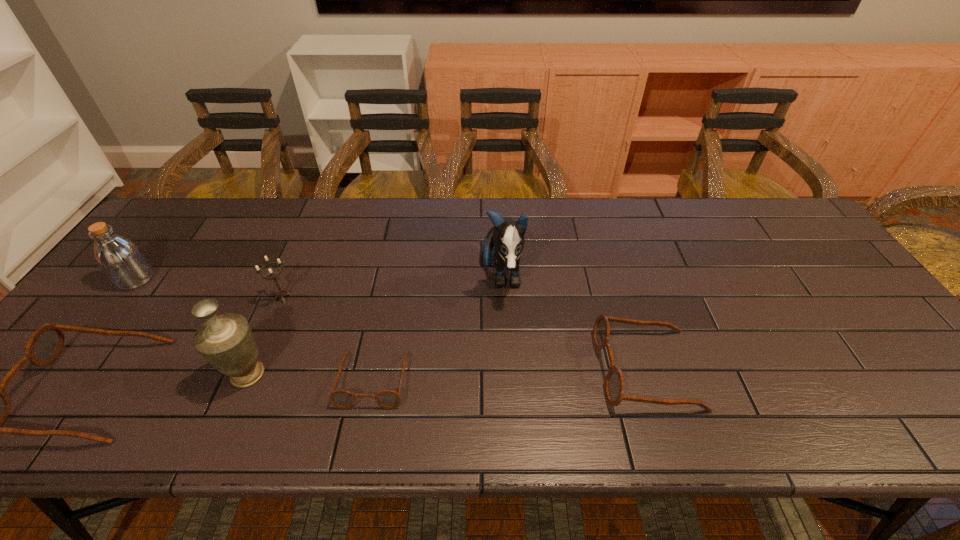
Where is `free space at the far left corner of the desktop`? This screenshot has width=960, height=540. free space at the far left corner of the desktop is located at coordinates (194, 217).

In the image, there is a desktop. What are the coordinates of `free region at the near right corner` in the screenshot? It's located at (860, 373).

I want to click on blank region between the second object from right to left and the shortest object, so click(438, 328).

You are a GUI agent. You are given a task and a screenshot of the screen. Output one action in this format:
    pyautogui.click(x=<x>, y=<y>)
    Task: Click on the vacant area between the second shortest object and the sixth object from left to right
    
    Given the screenshot: What is the action you would take?
    pyautogui.click(x=574, y=323)

Where is `unoccupied area between the shortest object and the rightmost object`? unoccupied area between the shortest object and the rightmost object is located at coordinates (510, 374).

Locate an element on the screen. free spot between the candle holder and the sixth tallest object is located at coordinates (466, 334).

Where is `vacant area that lies between the bottle and the urn`? Image resolution: width=960 pixels, height=540 pixels. vacant area that lies between the bottle and the urn is located at coordinates (192, 327).

You are a GUI agent. You are given a task and a screenshot of the screen. Output one action in this format:
    pyautogui.click(x=<x>, y=<y>)
    Task: Click on the unoccupied area between the puppy and the fifth object from left to right
    The width and height of the screenshot is (960, 540).
    Given the screenshot: What is the action you would take?
    pyautogui.click(x=438, y=328)

Identify the location of the third closest object to the leftmost spectacles. (281, 293).

Locate which object ranks second in proximity to the fifth shortest object. Please provide its 2D coordinates. Your answer should be formatted as a tuple, i.e. [(x, y)], where the tuple contains the x and y coordinates of a point satisfying the conditions above.

[(281, 293)]